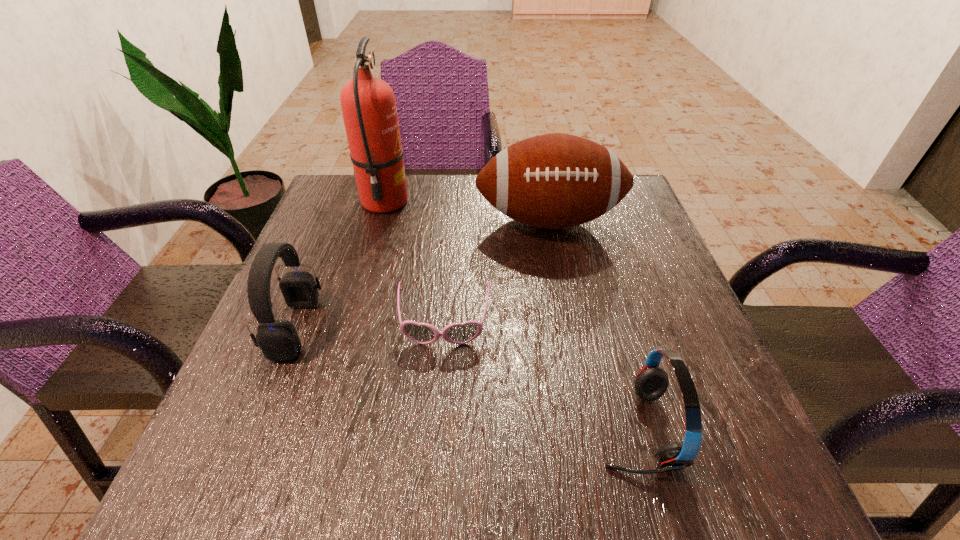
Locate an element on the screen. fire extinguisher is located at coordinates (368, 104).

Locate an element on the screen. This screenshot has height=540, width=960. the tallest object is located at coordinates coord(368,104).

You are a GUI agent. You are given a task and a screenshot of the screen. Output one action in this format:
    pyautogui.click(x=<x>, y=<y>)
    Task: Click on the fourth shortest object
    This screenshot has width=960, height=540.
    Given the screenshot: What is the action you would take?
    pyautogui.click(x=553, y=181)

Find the location of `the leftmost object`. the leftmost object is located at coordinates (278, 340).

Image resolution: width=960 pixels, height=540 pixels. Find the location of `the farther headset`. the farther headset is located at coordinates (278, 340).

Image resolution: width=960 pixels, height=540 pixels. What are the coordinates of `the fourth tallest object` in the screenshot? It's located at (651, 382).

At what (x,y) coordinates should I click in order to perform the action: click on the nearest object. Please return your answer as a coordinate pair (x, y). This screenshot has width=960, height=540. Looking at the image, I should click on 651,382.

Locate an element on the screen. This screenshot has height=540, width=960. the shortest object is located at coordinates (422, 333).

Locate an element on the screen. The width and height of the screenshot is (960, 540). free space located 0.120m on the side of the fire extinguisher with the nozzle and handle is located at coordinates (457, 202).

The height and width of the screenshot is (540, 960). Find the location of `free spot located on the laces of the football`. free spot located on the laces of the football is located at coordinates (563, 286).